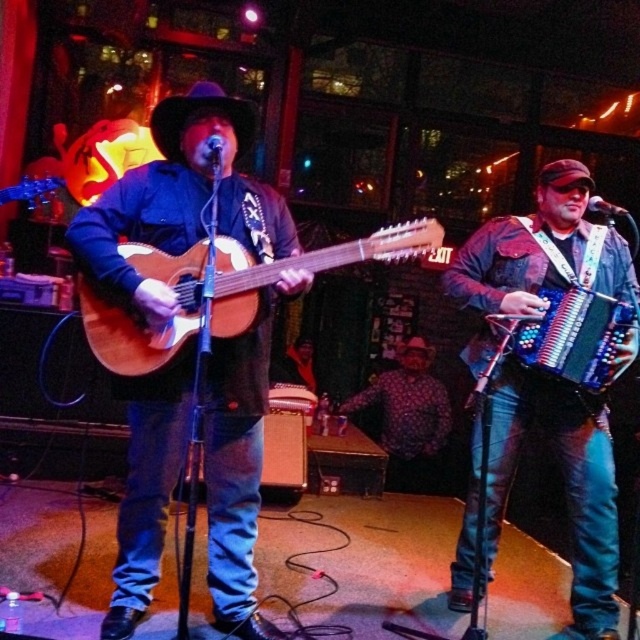
Question: Is blue denim jeans at right thinner than multicolored plastic accordion at right?

Choices:
 (A) no
 (B) yes

Answer: (A)

Question: Which of these objects is positioned farthest from the polka dot shirt at center?

Choices:
 (A) blue denim jeans at right
 (B) matte wood guitar at center

Answer: (B)

Question: Which point is farther to the camera?

Choices:
 (A) matte wood guitar at center
 (B) polka dot shirt at center

Answer: (B)

Question: Which object is positioned closest to the matte brown guitar at left?

Choices:
 (A) polka dot shirt at center
 (B) multicolored plastic accordion at right
 (C) matte wood guitar at center
 (D) blue denim jeans at right

Answer: (C)

Question: Is matte brown guitar at left bigger than matte wood guitar at center?

Choices:
 (A) yes
 (B) no

Answer: (A)

Question: Can you confirm if matte brown guitar at left is bigger than matte wood guitar at center?

Choices:
 (A) no
 (B) yes

Answer: (B)